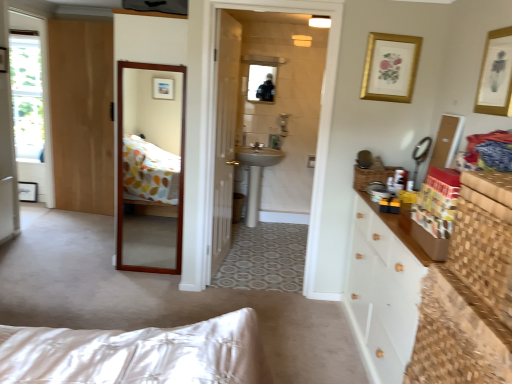
Image resolution: width=512 pixels, height=384 pixels. I want to click on free space to the back side of wooden mirror at center, so click(150, 257).